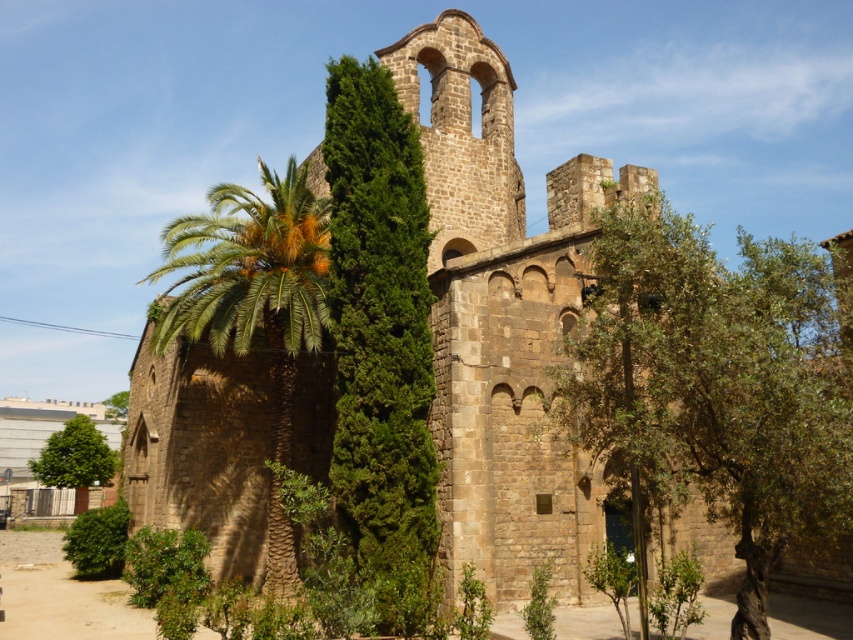
You are a gardener planning to plant a new tree in the garden near the ancient stone building. You have two options based on the image you see. The green leafy tree at right and the green leafy palm at left. If you want a wider tree for shade, which one should you choose?

The green leafy tree at right has a larger width than the green leafy palm at left, so it would be the better choice for providing more shade due to its greater width.

You are standing in front of the ancient stone building and see the green textured tree at center and the green leafy tree at lower left. Which tree is closer to you?

The green textured tree at center is closer to you because it is in front of the green leafy tree at lower left.